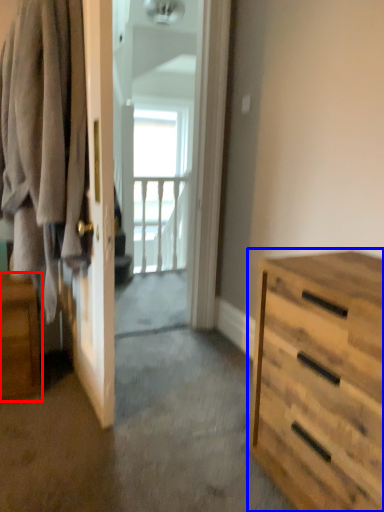
Question: Which object appears farthest to the camera in this image, nightstand (highlighted by a red box) or chest of drawers (highlighted by a blue box)?

Choices:
 (A) nightstand
 (B) chest of drawers

Answer: (A)